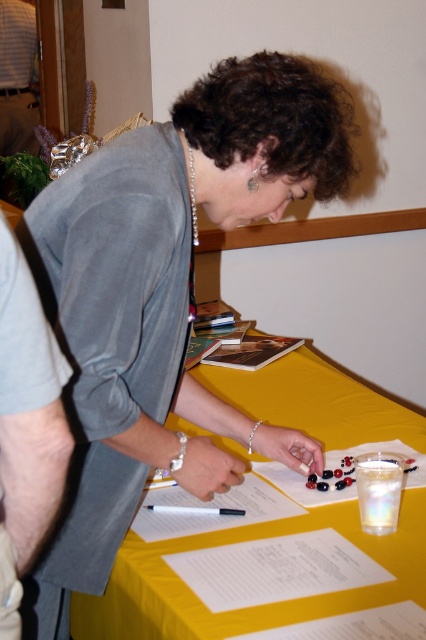
Question: Is yellow fabric table at center bigger than black plastic pen at center?

Choices:
 (A) yes
 (B) no

Answer: (A)

Question: Which point appears farthest from the camera in this image?

Choices:
 (A) (400, 448)
 (B) (46, 360)
 (C) (166, 513)
 (D) (8, 24)

Answer: (D)

Question: Does gray fabric shirt at left have a greater width compared to black plastic pen at center?

Choices:
 (A) no
 (B) yes

Answer: (A)

Question: Is yellow fabric table at center positioned at the back of black plastic pen at center?

Choices:
 (A) no
 (B) yes

Answer: (A)

Question: Which object is farther from the camera taking this photo?

Choices:
 (A) yellow fabric table at center
 (B) brushed metal water at bottle left
 (C) gray fabric shirt at left

Answer: (B)

Question: Estimate the real-world distances between objects in this image. Which object is farther from the gray fabric shirt at left?

Choices:
 (A) yellow fabric table at center
 (B) black plastic pen at center
 (C) brushed metal water at bottle left

Answer: (C)